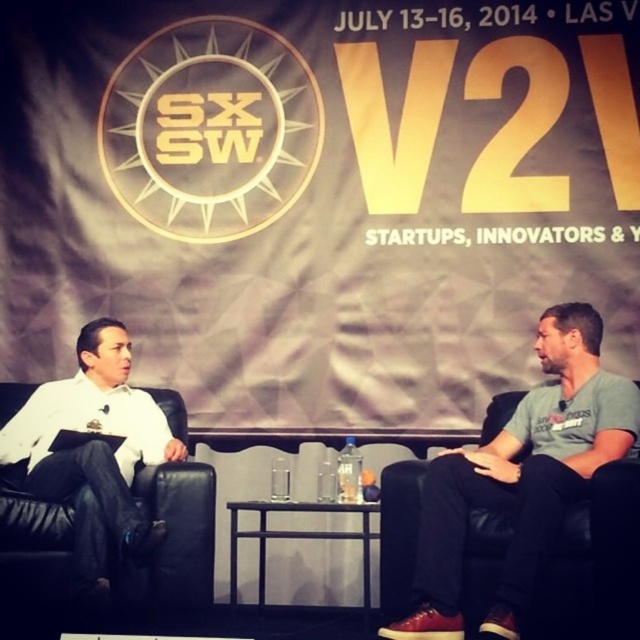
Does gray cotton t-shirt at right appear on the right side of white matte shirt at left?

Yes, gray cotton t-shirt at right is to the right of white matte shirt at left.

Does point (577, 320) lie behind point (64, 483)?

Yes, point (577, 320) is farther from viewer.

This screenshot has width=640, height=640. I want to click on gray cotton t-shirt at right, so click(x=522, y=477).